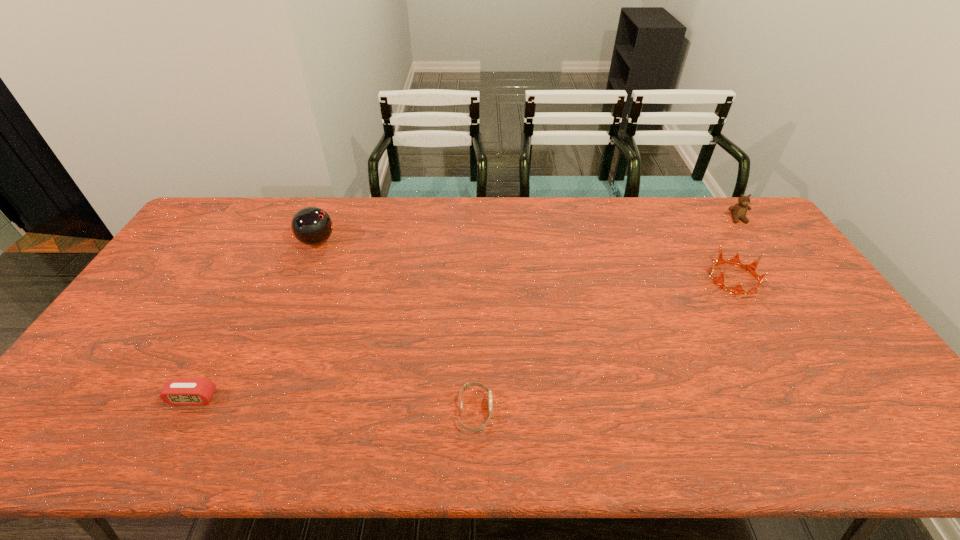
This screenshot has width=960, height=540. Identify the location of vacant space at the left edge. (176, 275).

The width and height of the screenshot is (960, 540). Identify the location of vacant space at the right edge of the desktop. (802, 305).

Identify the location of vacant space at the far right corner of the desktop. The width and height of the screenshot is (960, 540). (726, 218).

This screenshot has height=540, width=960. Identify the location of vacant area between the leftmost object and the watch. (334, 404).

Locate an element on the screen. unoccupied area between the second object from left to right and the third shortest object is located at coordinates (525, 260).

Find the location of a particular element. vacant space that's between the bowling ball and the third nearest object is located at coordinates (525, 260).

Where is `unoccupied area between the watch and the alarm clock`? This screenshot has width=960, height=540. unoccupied area between the watch and the alarm clock is located at coordinates (334, 404).

The width and height of the screenshot is (960, 540). In order to click on free area in between the second object from left to right and the fourth object from left to right in this screenshot , I will do `click(525, 260)`.

Find the location of a particular element. Image resolution: width=960 pixels, height=540 pixels. free point between the tallest object and the farthest object is located at coordinates (527, 230).

Where is `free space between the fourth object from left to right and the farthest object`? The width and height of the screenshot is (960, 540). free space between the fourth object from left to right and the farthest object is located at coordinates (735, 249).